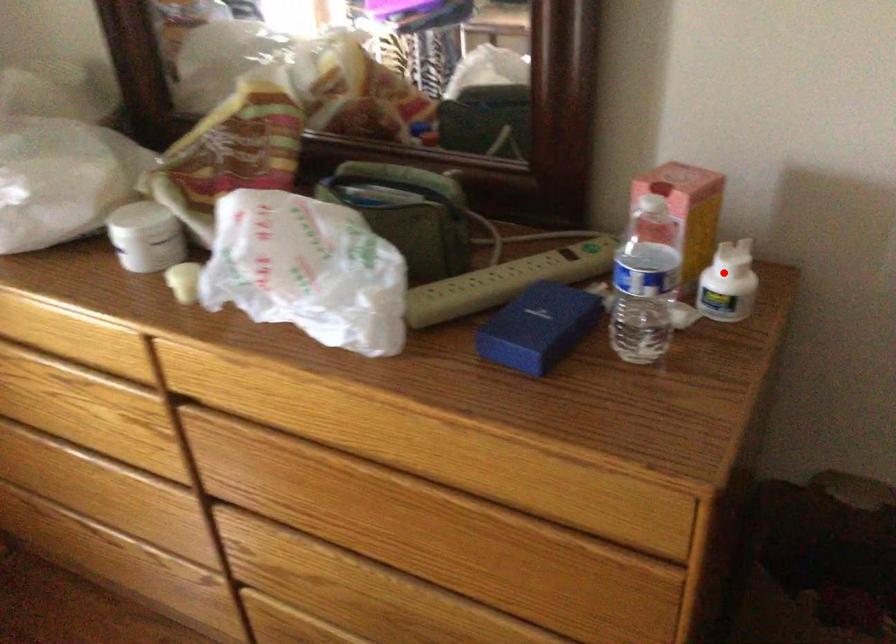
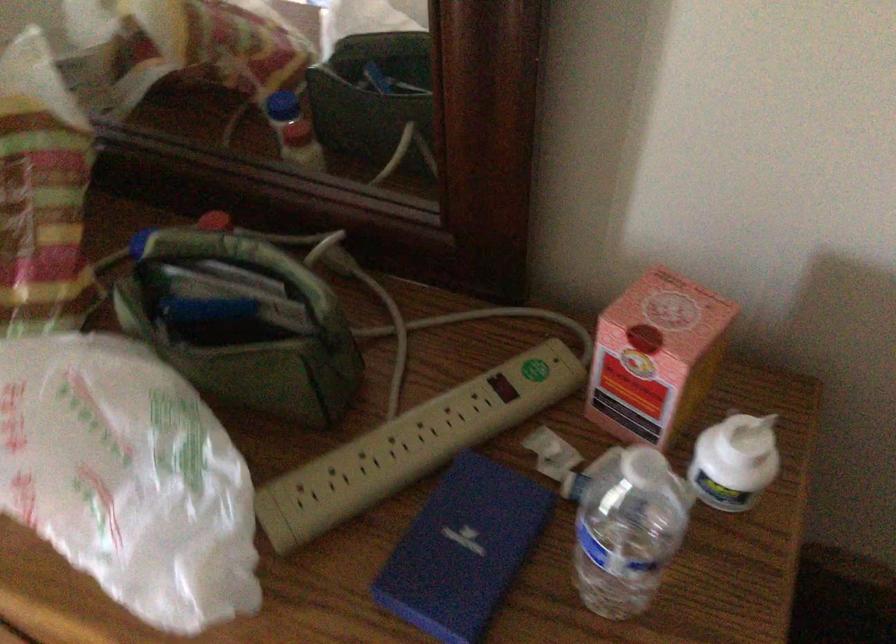
The point at the highlighted location is marked in the first image. Where is the corresponding point in the second image?

(735, 462)